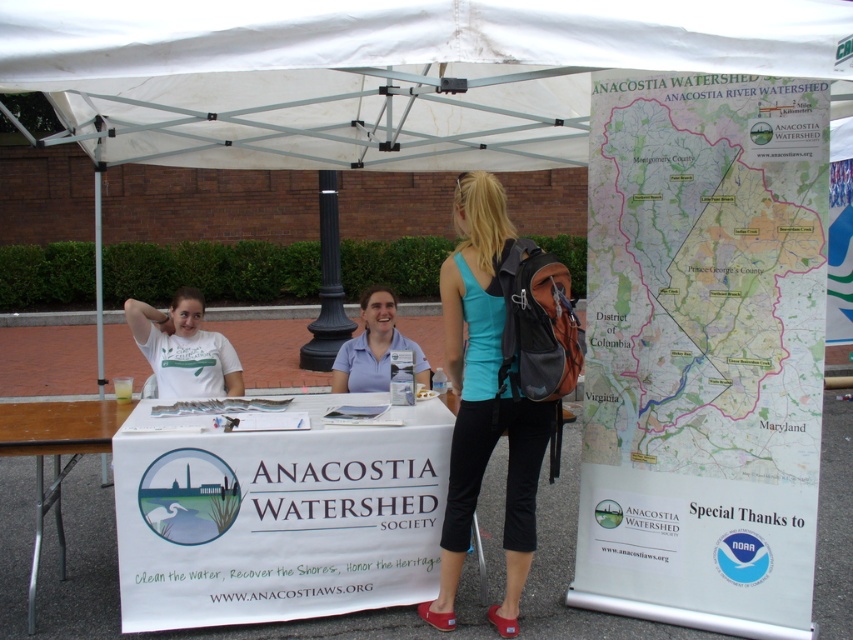
Question: Among these points, which one is nearest to the camera?

Choices:
 (A) (326, 273)
 (B) (840, 76)
 (C) (212, 396)
 (D) (577, 570)

Answer: (B)

Question: Estimate the real-world distances between objects in this image. Which object is closer to the matte white t-shirt at left?

Choices:
 (A) white fabric canopy at upper center
 (B) teal fabric tank top at center
 (C) white fabric table at center

Answer: (C)

Question: Can you confirm if blue cotton shirt at center is smaller than black polished stone pole at center?

Choices:
 (A) yes
 (B) no

Answer: (A)

Question: Does paper map at right appear on the left side of white fabric canopy at upper center?

Choices:
 (A) no
 (B) yes

Answer: (A)

Question: Which point appears closest to the camera in this image?

Choices:
 (A) (54, 408)
 (B) (392, 500)
 (C) (312, 330)
 (D) (665, 445)

Answer: (B)

Question: Is blue cotton shirt at center bigger than black polished stone pole at center?

Choices:
 (A) yes
 (B) no

Answer: (B)